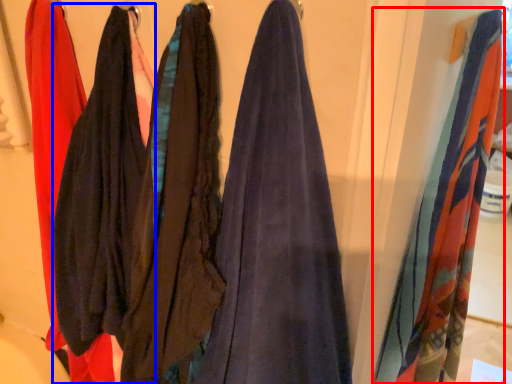
Question: Which of the following is the closest to the observer, towel (highlighted by a red box) or clothing (highlighted by a blue box)?

Choices:
 (A) towel
 (B) clothing

Answer: (B)